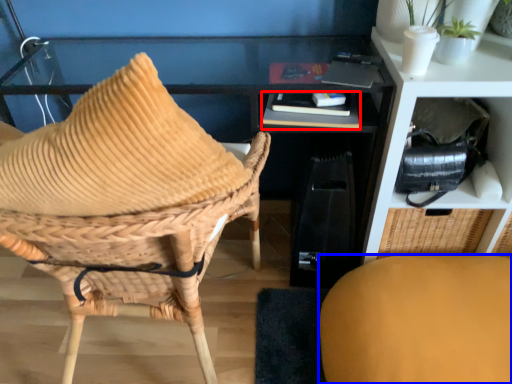
Question: Which of the following is the farthest to the observer, book (highlighted by a red box) or chair (highlighted by a blue box)?

Choices:
 (A) book
 (B) chair

Answer: (A)